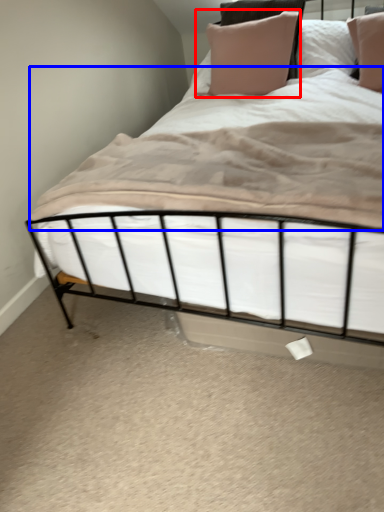
Question: Among these objects, which one is farthest to the camera, pillow (highlighted by a red box) or sheet (highlighted by a blue box)?

Choices:
 (A) pillow
 (B) sheet

Answer: (A)